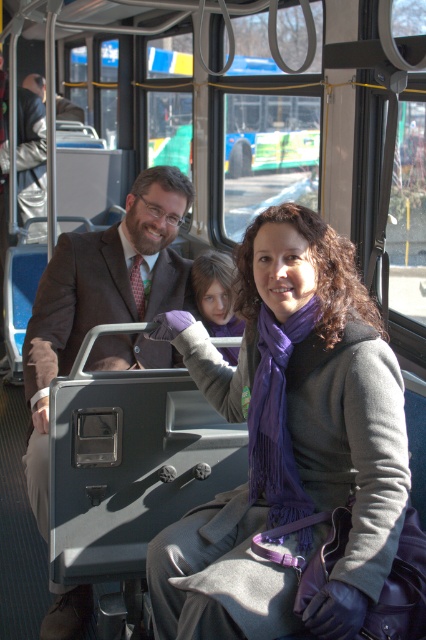
You are a photographer taking a picture of the passengers on the bus. You want to ensure the purple soft scarf at center and the matte brown suit at center are both visible in the frame. Which object should you position closer to the left side of your camera viewfinder to include both?

To include both the purple soft scarf at center and the matte brown suit at center in the frame, position the matte brown suit at center closer to the left side of the camera viewfinder since the purple soft scarf at center is already to its right.

You are a delivery robot on the bus and need to place a package between the purple soft scarf at center and the matte brown suit at center. The package is 35 inches long. Will it fit in the space between them?

The distance between the purple soft scarf at center and the matte brown suit at center is 34.95 inches. The package is 35 inches long, so it will not fit in the space between them.

You are a passenger on the bus and want to know what is located at the exact coordinates of point (288, 442). What object is there?

The purple soft scarf at center is located at point (288, 442).